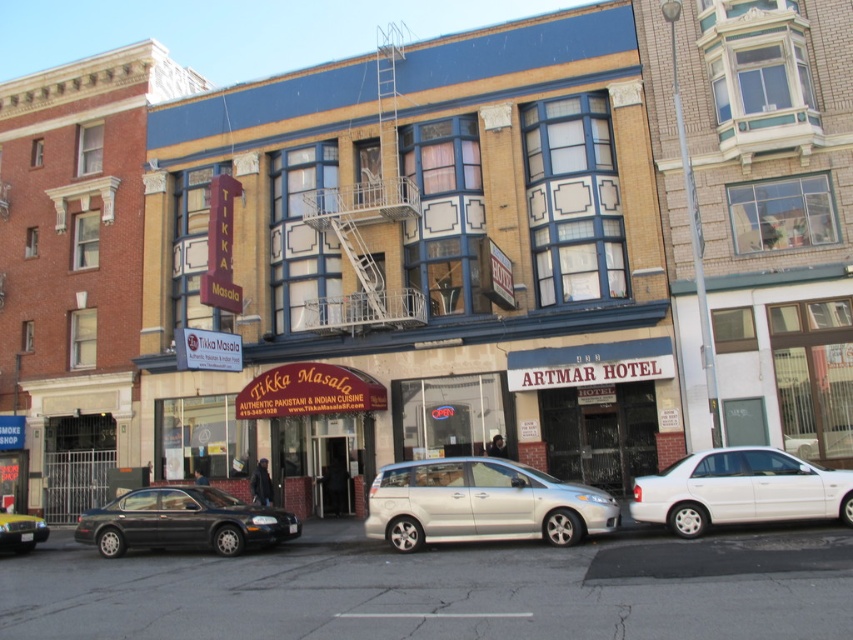
Question: Does silver metallic minivan at center have a larger size compared to white glossy sedan at lower right?

Choices:
 (A) yes
 (B) no

Answer: (A)

Question: Considering the real-world distances, which object is farthest from the black glossy sedan at lower left?

Choices:
 (A) maroon fabric signboard at center
 (B) white glossy sedan at lower right

Answer: (B)

Question: Where is maroon fabric signboard at center located in relation to black glossy sedan at lower left in the image?

Choices:
 (A) right
 (B) left

Answer: (A)

Question: Does silver metallic minivan at center lie in front of white glossy sedan at lower right?

Choices:
 (A) yes
 (B) no

Answer: (B)

Question: Which point is farther to the camera?

Choices:
 (A) silver metallic minivan at center
 (B) maroon fabric signboard at center
 (C) shiny black sedan at lower left

Answer: (B)

Question: Which of the following is the farthest from the observer?

Choices:
 (A) (839, 474)
 (B) (177, 515)
 (C) (9, 529)

Answer: (C)